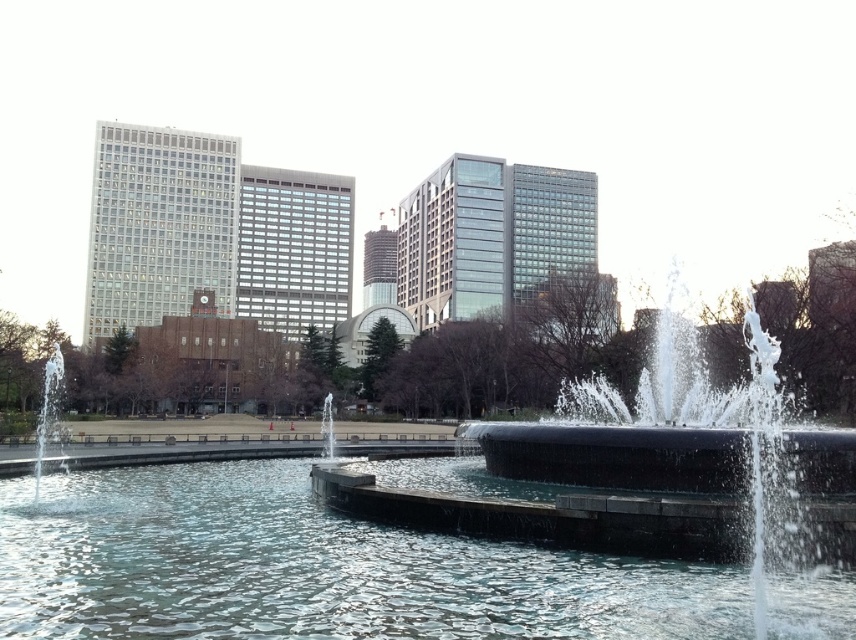
You are standing at the point marked by the coordinates point (312,568) in the park. What is located at this position?

The point (312,568) marks clear water at center.

You are a park visitor who wants to take a photo of the clear glass fountain at center without the clear water at center in the frame. Is this possible given their positions?

The clear water at center is above the clear glass fountain at center, so it would block the view of the fountain. Therefore, it is not possible to take a photo of the clear glass fountain at center without the clear water at center in the frame.

In the scene shown: You are a park visitor who wants to place a 2 meter wide picnic blanket between the clear water at center and the clear glass fountain at center. Is there enough space between them to fit the blanket without overlapping either?

The clear water at center and clear glass fountain at center are 6.63 meters apart. Since the picnic blanket is only 2 meters wide, there is sufficient space between them to place the blanket without overlapping either object.